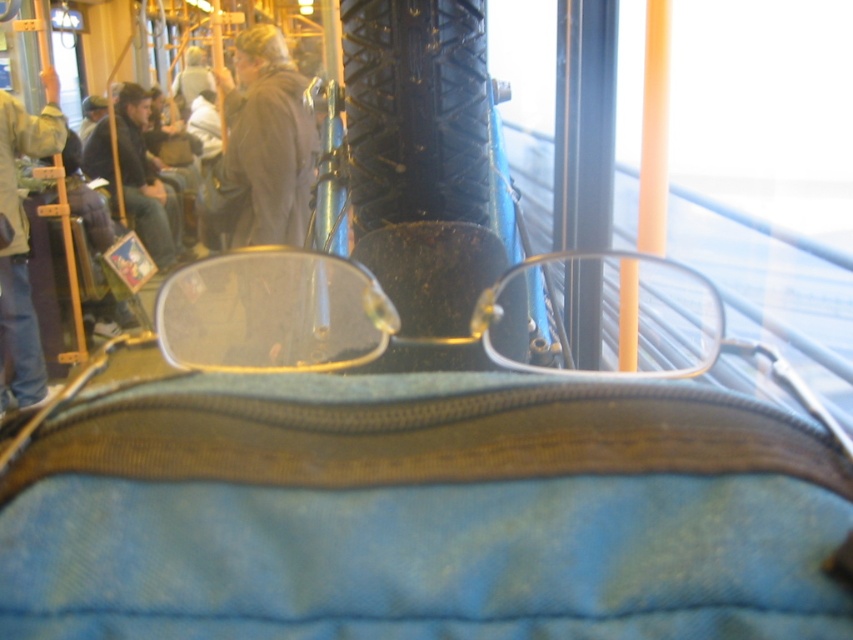
You are a passenger on a bus and need to place a 18 inch wide book on the seat next to you. The clear plastic glasses at center are currently occupying some space. Can you fit the book next to the glasses?

The clear plastic glasses at center are 20.14 inches apart, so the 18 inch wide book can fit next to them as there is sufficient space.

You are a passenger on a bus and you want to place your clear plastic glasses at center somewhere safe. The dark gray jacket at center is already on the seat. Can you put your glasses on the jacket without them falling off?

The clear plastic glasses at center is positioned under dark gray jacket at center, so placing them on the jacket might cause them to slide off since the jacket is already covering the seat. Consider placing them elsewhere for stability.